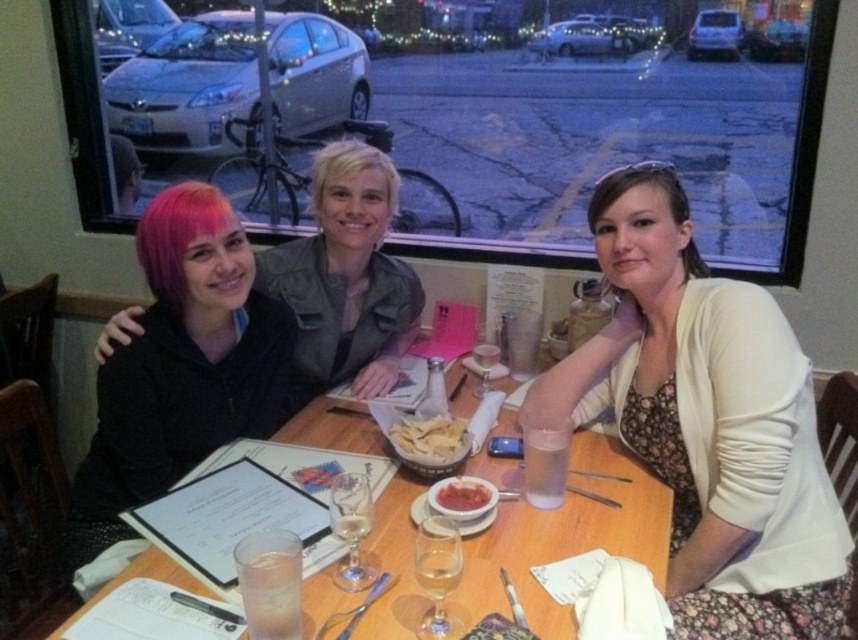
Question: Is floral dress at center to the right of pink hair at center from the viewer's perspective?

Choices:
 (A) yes
 (B) no

Answer: (A)

Question: Which point is closer to the camera?

Choices:
 (A) (182, 266)
 (B) (397, 433)

Answer: (A)

Question: Does brown matte hair at upper right appear on the right side of blondehair at center?

Choices:
 (A) yes
 (B) no

Answer: (A)

Question: Can you confirm if pink matte hair at left is positioned to the right of brown matte hair at upper right?

Choices:
 (A) no
 (B) yes

Answer: (A)

Question: Which object is positioned closest to the smooth matte red sauce at center?

Choices:
 (A) brown crispy chips at center
 (B) pink matte hair at left
 (C) wooden table at center

Answer: (A)

Question: Which of the following is the farthest from the observer?

Choices:
 (A) brown crispy chips at center
 (B) blondehair at center
 (C) brown matte hair at upper right

Answer: (B)